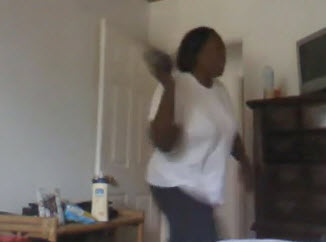
You are a GUI agent. You are given a task and a screenshot of the screen. Output one action in this format:
    pyautogui.click(x=<x>, y=<y>)
    Task: Click on the lotion bottle
    The width and height of the screenshot is (326, 242).
    Given the screenshot: What is the action you would take?
    pyautogui.click(x=101, y=196)